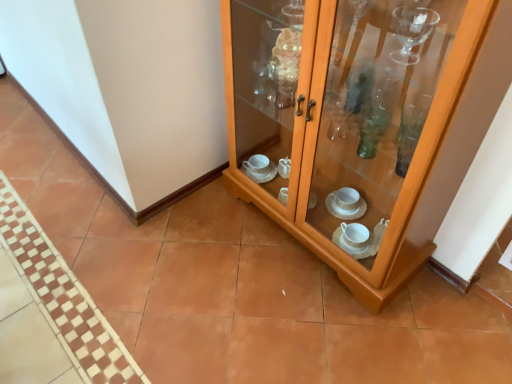
I want to click on wooden cabinet at center, so click(366, 123).

This screenshot has width=512, height=384. Describe the element at coordinates (366, 123) in the screenshot. I see `wooden cabinet at center` at that location.

Where is `wooden cabinet at center`? wooden cabinet at center is located at coordinates (366, 123).